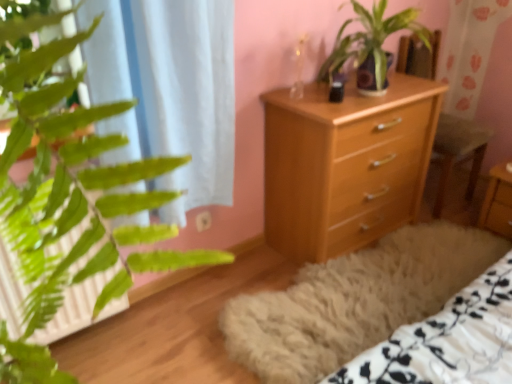
Question: In the image, is light wood chest of drawers at center positioned in front of or behind wooden armchair at center?

Choices:
 (A) behind
 (B) front

Answer: (B)

Question: Is light wood chest of drawers at center to the left or to the right of wooden armchair at center in the image?

Choices:
 (A) right
 (B) left

Answer: (B)

Question: Which of these objects is positioned closest to the light wood chest of drawers at center?

Choices:
 (A) green leafy plant at center
 (B) white sheer curtain at left
 (C) wooden nightstand at center
 (D) wooden armchair at center

Answer: (A)

Question: Estimate the real-world distances between objects in this image. Which object is farther from the light wood chest of drawers at center?

Choices:
 (A) wooden nightstand at center
 (B) green leafy plant at center
 (C) wooden armchair at center
 (D) white sheer curtain at left

Answer: (A)